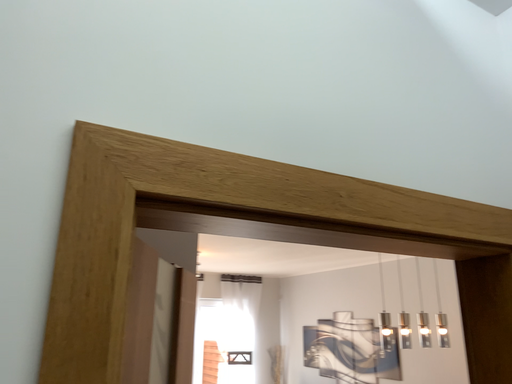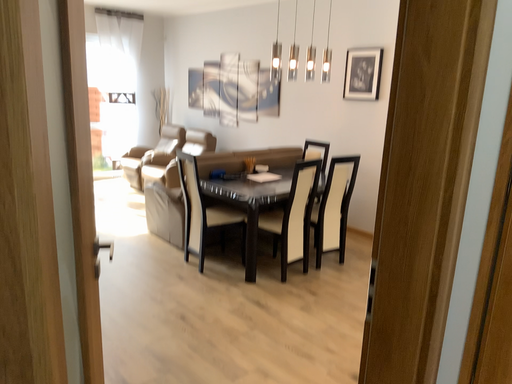
Question: Which way did the camera rotate in the video?

Choices:
 (A) rotated left
 (B) rotated right

Answer: (B)